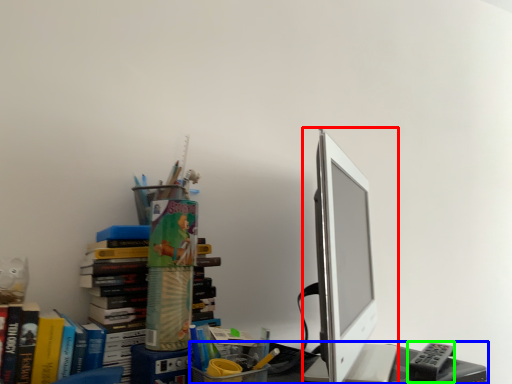
Question: Which object is positioned farthest from computer monitor (highlighted by a red box)? Select from desk (highlighted by a blue box) and stationery (highlighted by a green box).

Choices:
 (A) desk
 (B) stationery

Answer: (B)